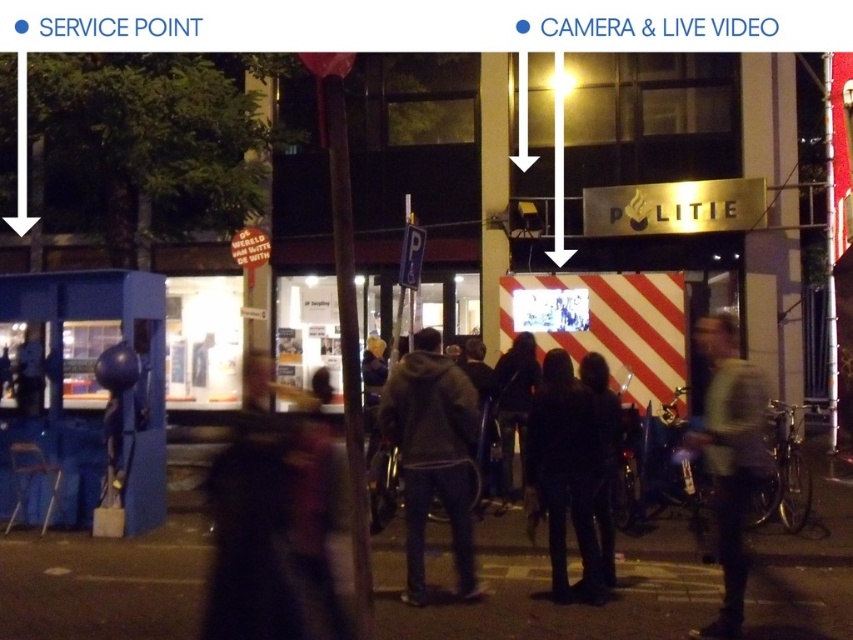
You are a delivery person who needs to hand a package to the recipient standing near the gray fabric jacket at lower right. You are currently standing near the dark gray hoodie at center. Which direction should you move to reach the recipient?

You should move to the right because the dark gray hoodie at center is to the left of the gray fabric jacket at lower right, so moving right will bring you closer to the recipient.

From the picture: You are a delivery person trying to find the police station entrance. You see a dark gray hoodie at center and a gray fabric jacket at lower right. Which clothing item is closer to the ground?

The dark gray hoodie at center is positioned under the gray fabric jacket at lower right, meaning it is closer to the ground.